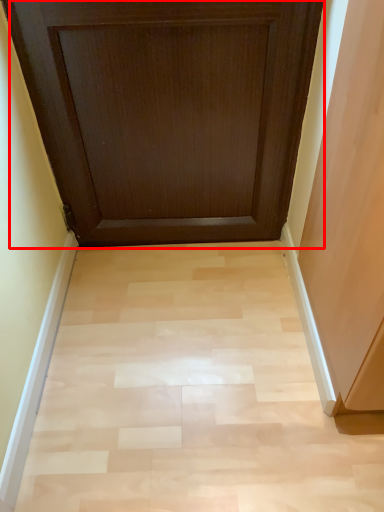
Question: Where is door (annotated by the red box) located in relation to plain in the image?

Choices:
 (A) right
 (B) left

Answer: (B)